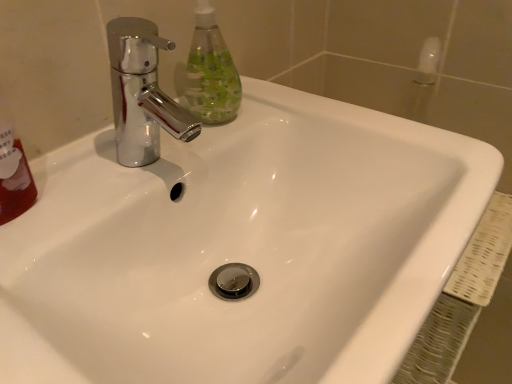
The width and height of the screenshot is (512, 384). In order to click on free spot in front of clear plastic bottle at upper left in this screenshot , I will do `click(152, 168)`.